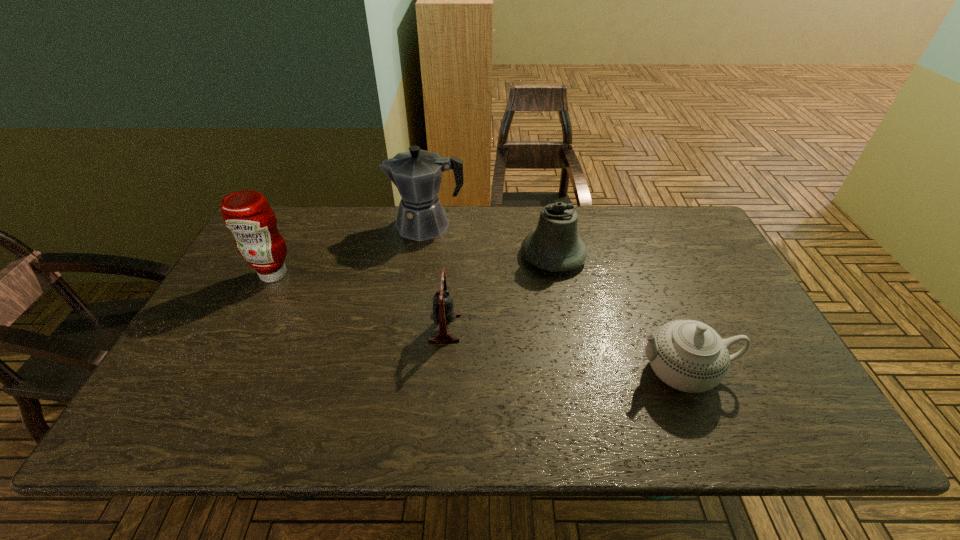
Where is `free region that satisfies the following two spatial constraints: 1. on the back side of the left bell; 2. on the right side of the right bell`? free region that satisfies the following two spatial constraints: 1. on the back side of the left bell; 2. on the right side of the right bell is located at coordinates (450, 255).

In order to click on vacant space that satisfies the following two spatial constraints: 1. on the front side of the nearer bell; 2. on the right side of the condiment in this screenshot , I will do `click(247, 328)`.

The width and height of the screenshot is (960, 540). Identify the location of free location that satisfies the following two spatial constraints: 1. at the spout of the right bell; 2. on the right side of the coffeepot. (422, 255).